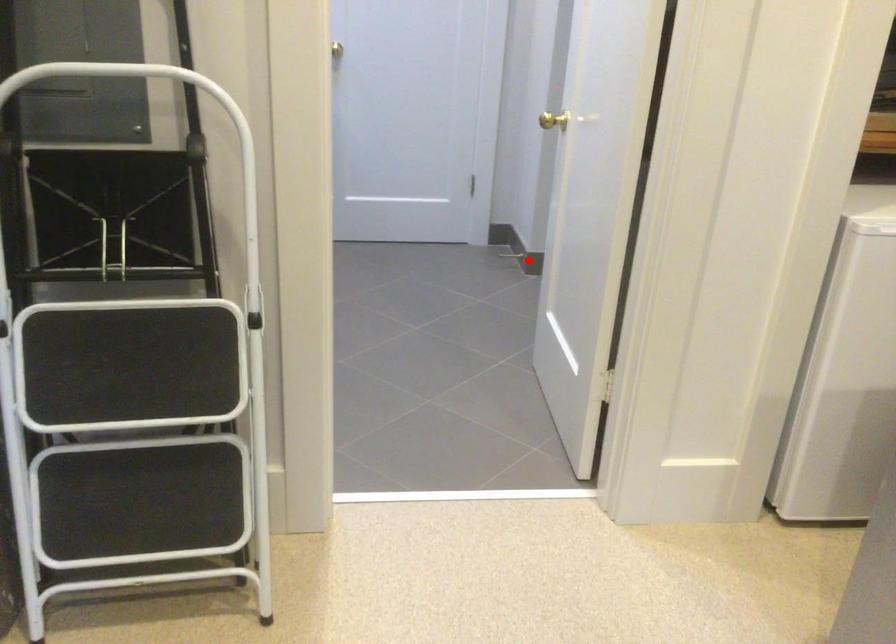
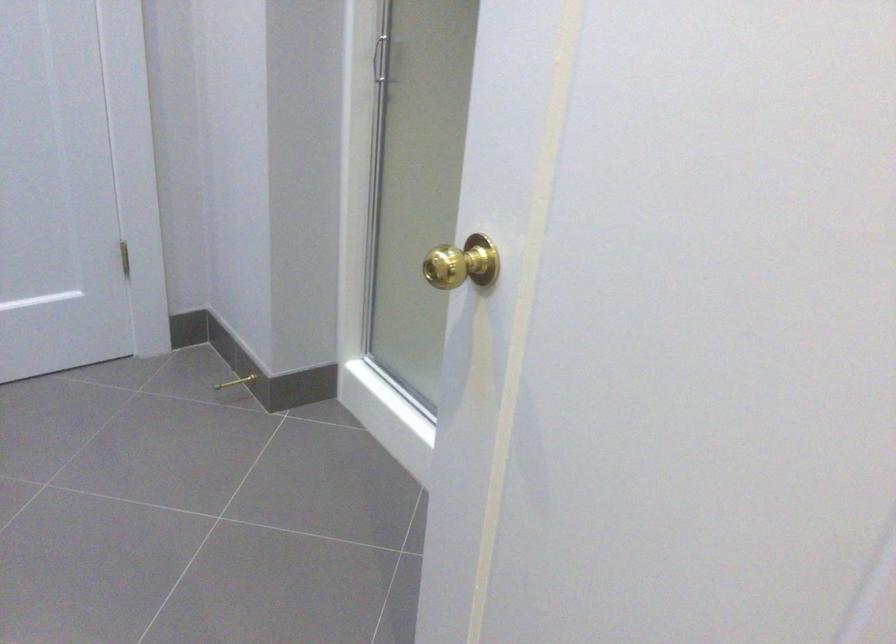
Find the pixel in the second image that matches the highlighted location in the first image.

(235, 382)